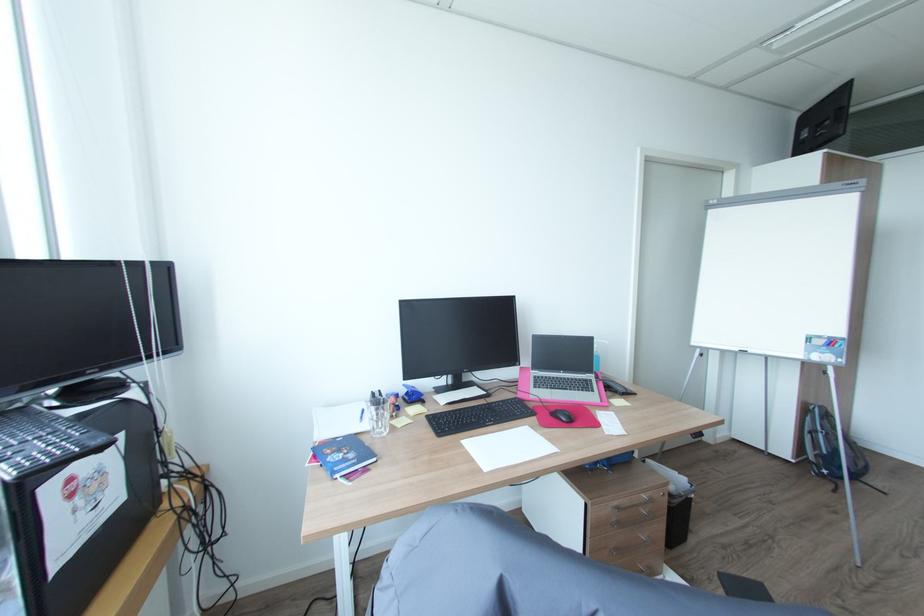
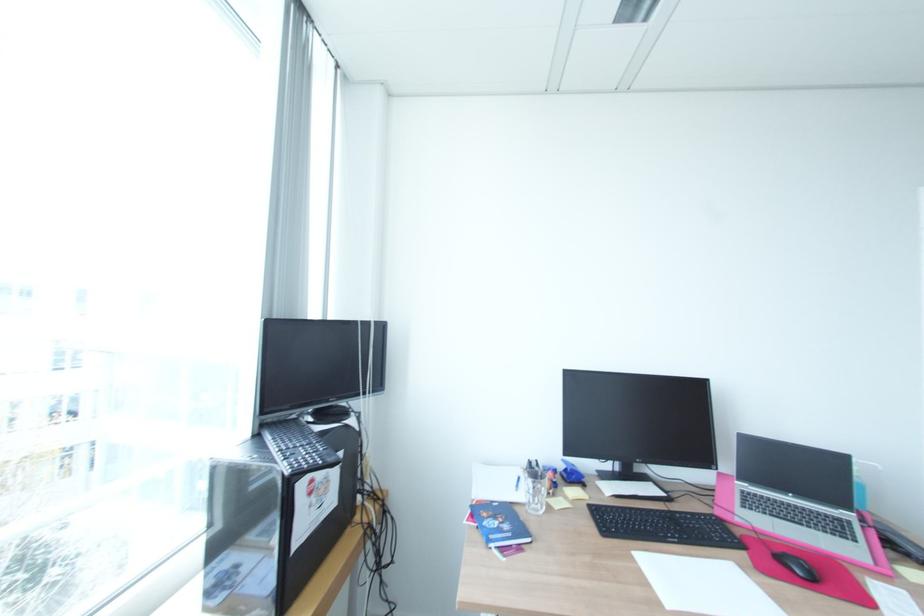
Where in the second image is the point corresponding to pixel 385 428 from the first image?

(541, 505)